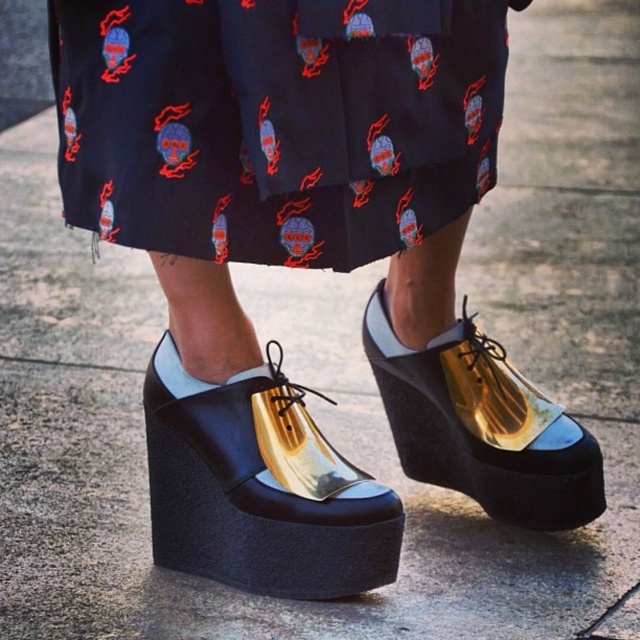
You are a fashion designer analyzing the image. You need to place a belt exactly at the center of the image. Will the belt overlap with the black cotton skirt at center?

The black cotton skirt at center is positioned at point (275, 122), which is not the exact center of the image. Therefore, placing a belt at the image center will not overlap with the black cotton skirt at center.

You are a fashion designer who wants to create a matching accessory that can be placed between the black cotton skirt at center and the gold reflective platform shoe at center. What is the minimum length of the accessory needed to bridge the gap between them?

The minimum length of the accessory needed to bridge the gap between the black cotton skirt at center and the gold reflective platform shoe at center should be at least 42.91 centimeters, as they are 42.91 centimeters apart from each other.